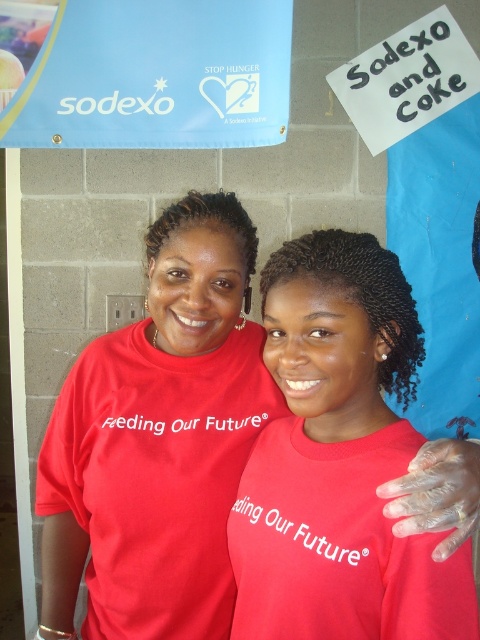
Question: Does matte red shirt at center appear on the right side of blue fabric sign at upper center?

Choices:
 (A) yes
 (B) no

Answer: (A)

Question: Among these objects, which one is nearest to the camera?

Choices:
 (A) blue fabric sign at upper center
 (B) matte red shirt at center

Answer: (B)

Question: Can you confirm if matte red shirt at center is positioned below blue fabric sign at upper center?

Choices:
 (A) no
 (B) yes

Answer: (B)

Question: Is matte red shirt at center above blue fabric sign at upper center?

Choices:
 (A) no
 (B) yes

Answer: (A)

Question: Which object appears farthest from the camera in this image?

Choices:
 (A) matte red shirt at center
 (B) blue fabric sign at upper center

Answer: (B)